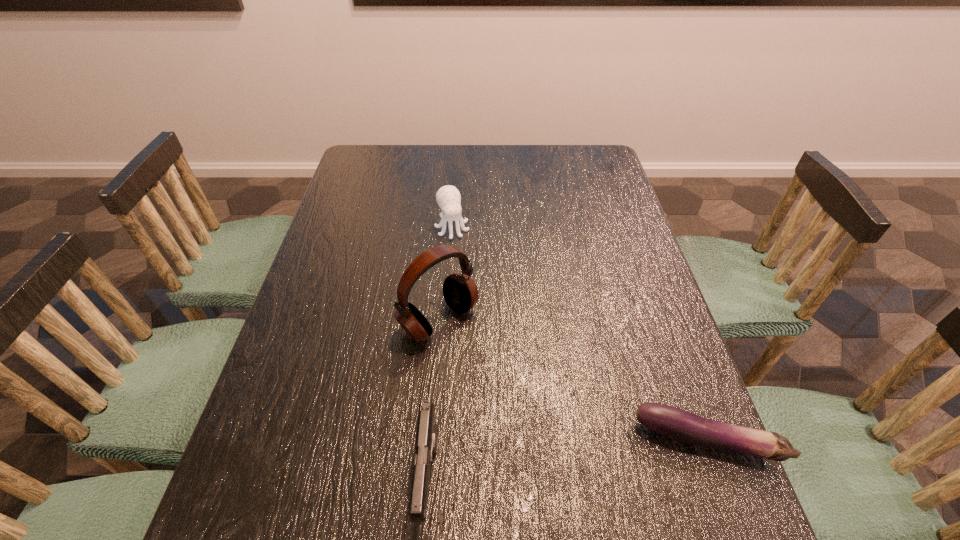
The width and height of the screenshot is (960, 540). What are the coordinates of `pistol` in the screenshot? It's located at 426,440.

You are a GUI agent. You are given a task and a screenshot of the screen. Output one action in this format:
    pyautogui.click(x=<x>, y=<y>)
    Task: Click on the shortest object
    
    Given the screenshot: What is the action you would take?
    pos(680,425)

Identify the location of eggplant. The width and height of the screenshot is (960, 540). (680, 425).

Identify the location of headset. This screenshot has width=960, height=540. click(460, 292).

The height and width of the screenshot is (540, 960). Identify the location of the second farthest object. (460, 292).

Locate an element on the screen. octopus is located at coordinates (448, 197).

Locate an element on the screen. free space located 0.290m on the left of the shortest object is located at coordinates (486, 440).

I want to click on vacant space located 0.340m on the ear pads of the third nearest object, so click(x=581, y=454).

Where is `vacant area located 0.310m on the ear pads of the third nearest object`? vacant area located 0.310m on the ear pads of the third nearest object is located at coordinates (569, 443).

Find the location of a particular element. This screenshot has width=960, height=540. free space located on the ear pads of the third nearest object is located at coordinates (524, 400).